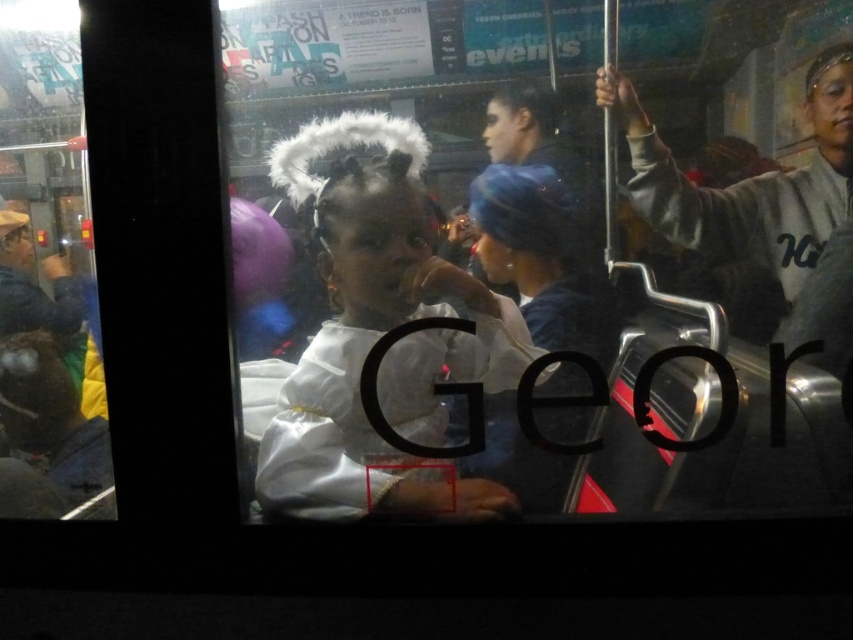
How far apart are white fluffy halo at center and gray fleece jacket at right?

The distance of white fluffy halo at center from gray fleece jacket at right is 18.22 inches.

Which of these two, white fluffy halo at center or gray fleece jacket at right, stands shorter?

gray fleece jacket at right

Image resolution: width=853 pixels, height=640 pixels. I want to click on white fluffy halo at center, so click(379, 333).

Where is `white fluffy halo at center`? This screenshot has height=640, width=853. white fluffy halo at center is located at coordinates (379, 333).